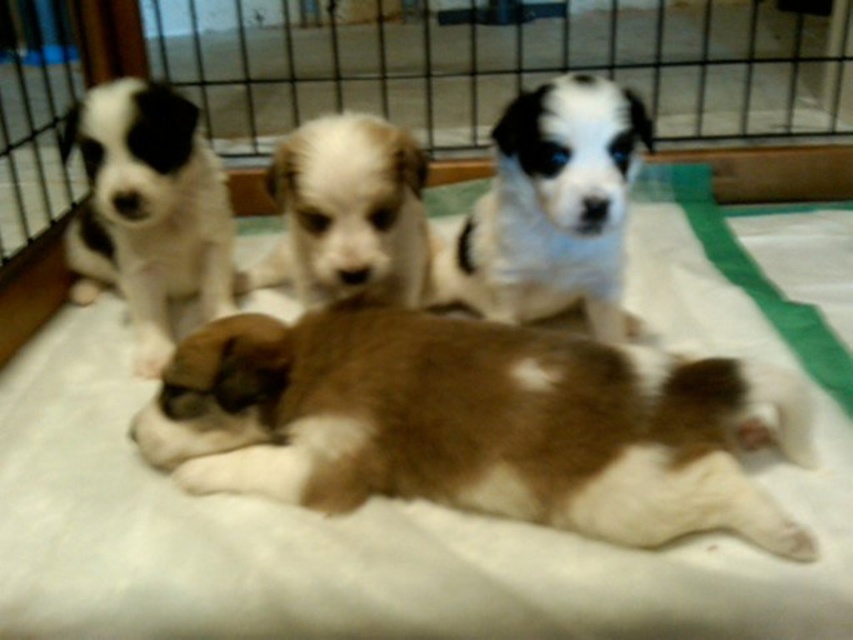
Is white-furred dog at center to the left of white fur at center from the viewer's perspective?

No, white-furred dog at center is not to the left of white fur at center.

Which is below, white-furred dog at center or white fur at center?

white fur at center is lower down.

Where is `white-furred dog at center`? white-furred dog at center is located at coordinates (550, 209).

Who is more distant from viewer, (157, 408) or (276, 282)?

Positioned behind is point (276, 282).

Is point (460, 502) in front of point (401, 180)?

Yes, point (460, 502) is closer to viewer.

In order to click on brown fur at center in this screenshot , I will do `click(474, 422)`.

Does metal wire cage at upper center appear on the left side of white fur puppy at left?

Incorrect, metal wire cage at upper center is not on the left side of white fur puppy at left.

This screenshot has height=640, width=853. I want to click on metal wire cage at upper center, so click(x=503, y=64).